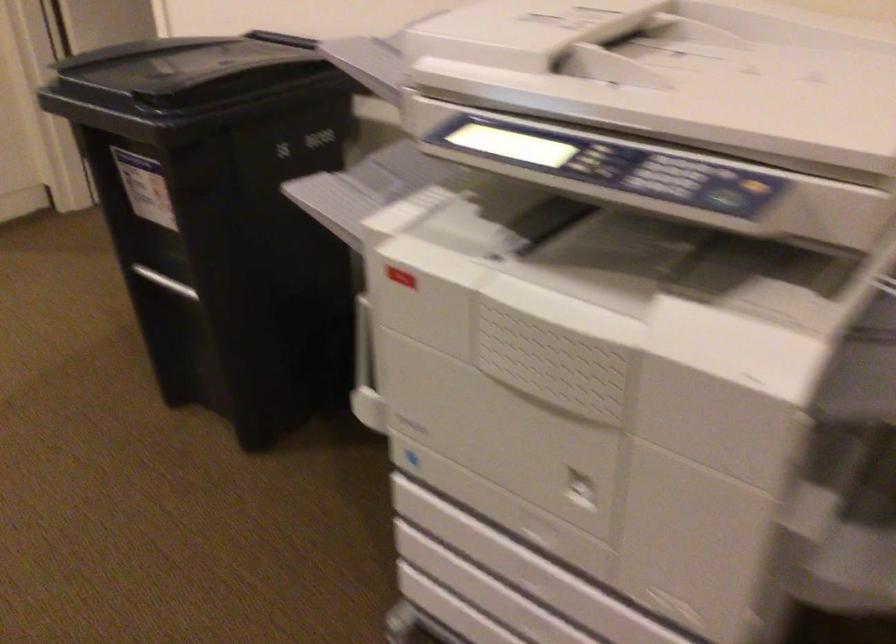
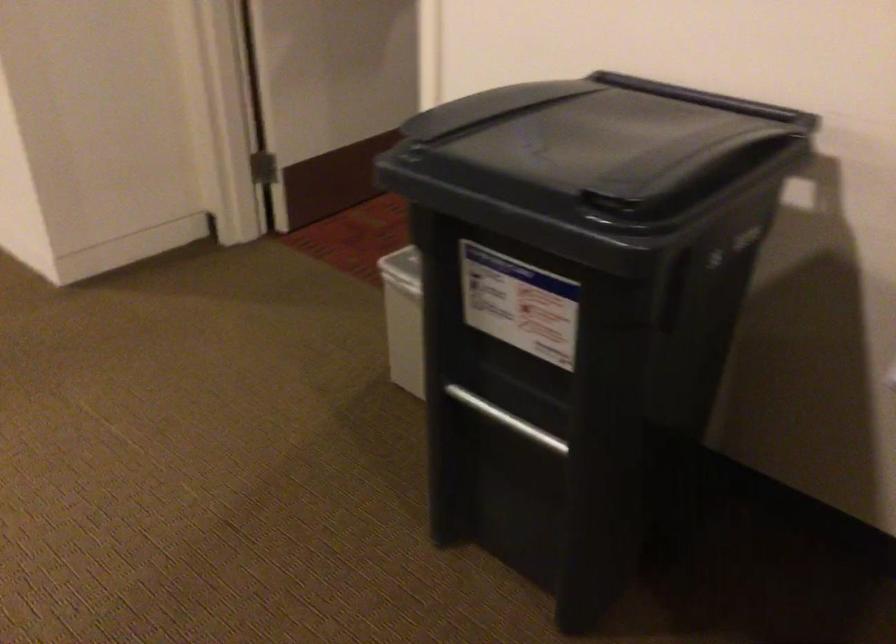
Question: The first image is from the beginning of the video and the second image is from the end. How did the camera likely rotate when shooting the video?

Choices:
 (A) Left
 (B) Right
 (C) Up
 (D) Down

Answer: (A)